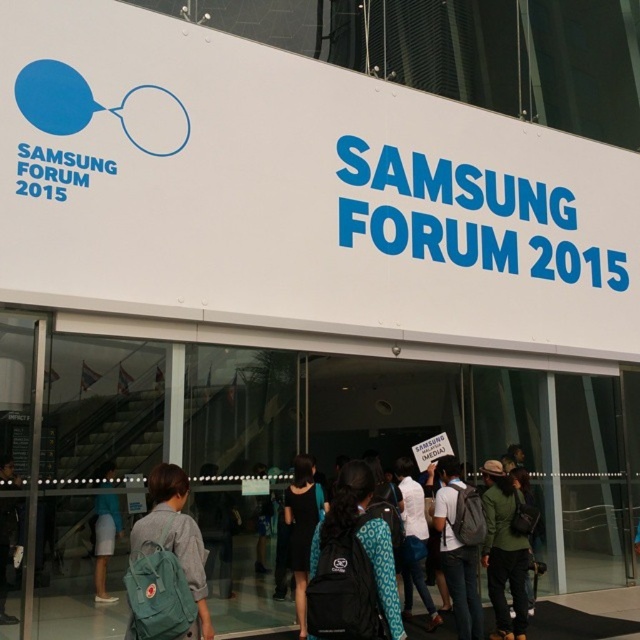
You are standing at the entrance of the Samsung Forum 2015 event. You see a green matte jacket at center and a light blue backpack at lower left. Which object is closer to you?

The green matte jacket at center is closer to you because it is further to the viewer than the light blue backpack at lower left.

You are attending the Samsung Forum 2015 and need to store your belongings. You have a matte black backpack at center and blue denim shorts at lower left. Which item can you place in a standard coat hanger designed for hanging items?

The blue denim shorts at lower left can be placed in a standard coat hanger designed for hanging items since the matte black backpack at center is larger and likely not suitable for hanging.